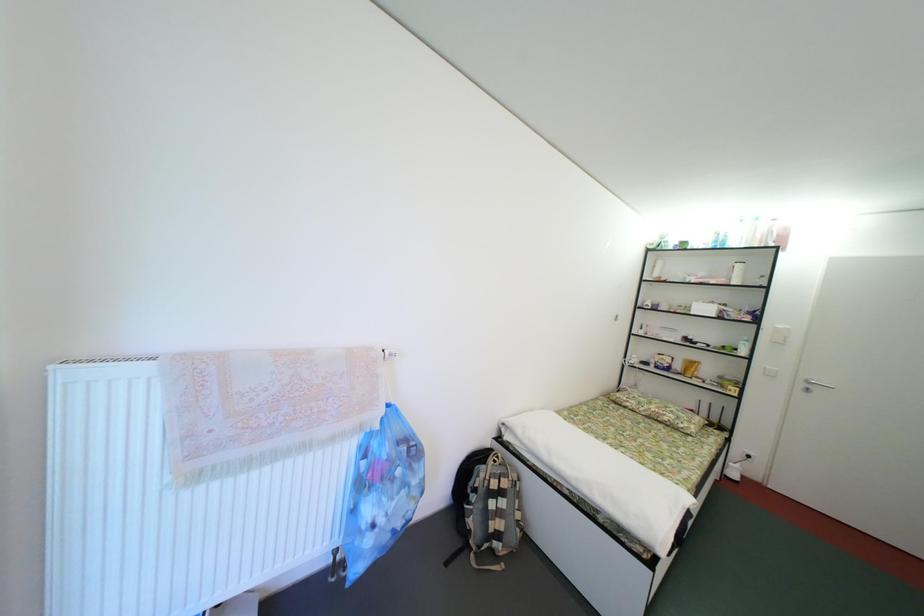
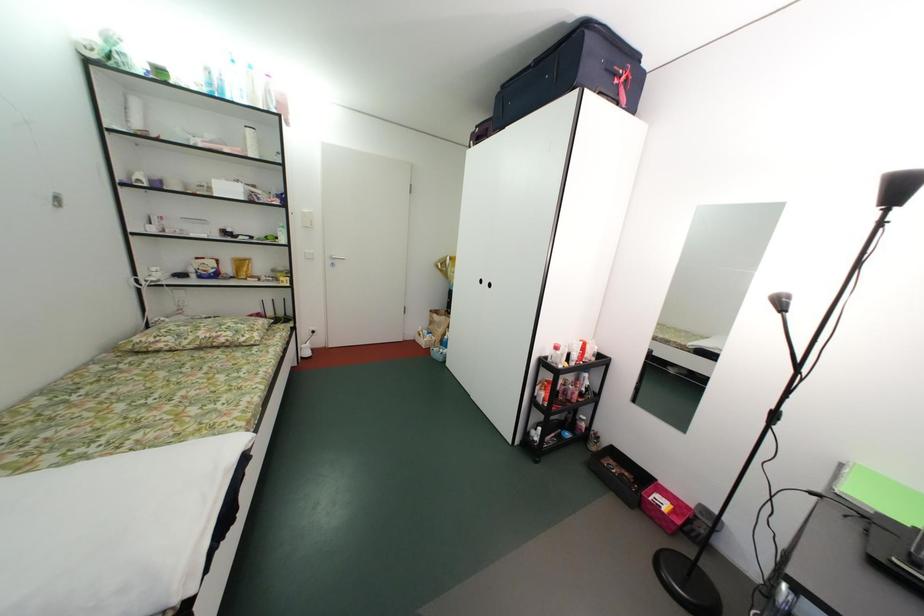
How did the camera likely rotate?

The camera rotated toward right-down.